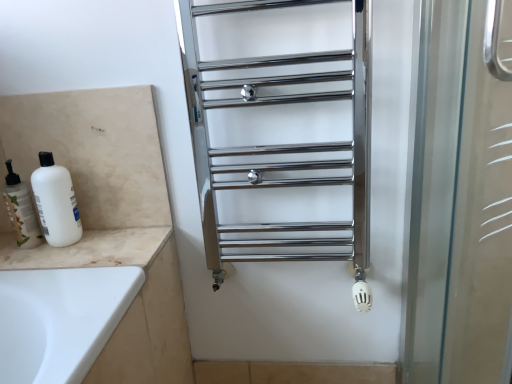
This screenshot has width=512, height=384. I want to click on white matte bottle at left, so click(x=21, y=210).

What is the approximate width of beige marble counter top at lower left?

8.49 inches.

Find the location of `polished chrome towel rack at center`. polished chrome towel rack at center is located at coordinates (281, 128).

In the scene shown: Which of these two, white matte bottle at left or beige marble counter top at lower left, stands taller?

Standing taller between the two is white matte bottle at left.

Relative to beige marble counter top at lower left, is white matte bottle at left in front or behind?

white matte bottle at left is behind beige marble counter top at lower left.

Is polished chrome towel rack at center oriented towards beige marble counter top at lower left?

No.

Can you confirm if polished chrome towel rack at center is positioned to the right of beige marble counter top at lower left?

Indeed, polished chrome towel rack at center is positioned on the right side of beige marble counter top at lower left.

Based on the photo, how many degrees apart are the facing directions of polished chrome towel rack at center and beige marble counter top at lower left?

1.02 degrees separate the facing orientations of polished chrome towel rack at center and beige marble counter top at lower left.

In the scene shown: From the image's perspective, does polished chrome towel rack at center appear higher than beige marble counter top at lower left?

Correct, polished chrome towel rack at center appears higher than beige marble counter top at lower left in the image.

From a real-world perspective, between white matte bottle at left and polished chrome towel rack at center, who is vertically lower?

white matte bottle at left.

Does white matte bottle at left turn towards polished chrome towel rack at center?

No, white matte bottle at left is not turned towards polished chrome towel rack at center.

Which of these two, white matte bottle at left or polished chrome towel rack at center, stands taller?

With more height is polished chrome towel rack at center.

Consider the image. From a real-world perspective, is beige marble counter top at lower left positioned above or below white matte bottle at left?

beige marble counter top at lower left is below white matte bottle at left.

How much distance is there between beige marble counter top at lower left and white matte bottle at left?

The distance of beige marble counter top at lower left from white matte bottle at left is 5.84 inches.

Based on their sizes in the image, would you say beige marble counter top at lower left is bigger or smaller than white matte bottle at left?

beige marble counter top at lower left is bigger than white matte bottle at left.

Would you say beige marble counter top at lower left is a long distance from white matte bottle at left?

Actually, beige marble counter top at lower left and white matte bottle at left are a little close together.

Considering the relative sizes of white matte bottle at left and beige marble counter top at lower left in the image provided, is white matte bottle at left bigger than beige marble counter top at lower left?

Yes.

From the image's perspective, is white matte bottle at left positioned above or below beige marble counter top at lower left?

Clearly, from the image's perspective, white matte bottle at left is above beige marble counter top at lower left.

Between white matte bottle at left and beige marble counter top at lower left, which one has larger width?

With larger width is beige marble counter top at lower left.

Is white matte bottle at left positioned far away from beige marble counter top at lower left?

Actually, white matte bottle at left and beige marble counter top at lower left are a little close together.

Is polished chrome towel rack at center at the left side of white matte bottle at left?

No.

This screenshot has height=384, width=512. Identify the location of cage above the white matte bottle at left (from the image's perspective). (281, 128).

Considering the points (339, 218) and (25, 207), which point is behind, point (339, 218) or point (25, 207)?

Positioned behind is point (339, 218).

Does polished chrome towel rack at center have a greater width compared to white matte bottle at left?

Indeed, polished chrome towel rack at center has a greater width compared to white matte bottle at left.

Does beige marble counter top at lower left turn towards polished chrome towel rack at center?

No, beige marble counter top at lower left is not turned towards polished chrome towel rack at center.

The height and width of the screenshot is (384, 512). In order to click on counter top on the left of the polished chrome towel rack at center in this screenshot , I will do `click(88, 250)`.

What's the angular difference between beige marble counter top at lower left and polished chrome towel rack at center's facing directions?

The angular difference between beige marble counter top at lower left and polished chrome towel rack at center is 1.02 degrees.

Which point is more forward, (x=45, y=248) or (x=213, y=148)?

The point (x=45, y=248) is closer.

The image size is (512, 384). I want to click on counter top below the white matte bottle at left (from a real-world perspective), so click(x=88, y=250).

At what (x,y) coordinates should I click in order to perform the action: click on cage that is above the beige marble counter top at lower left (from a real-world perspective). Please return your answer as a coordinate pair (x, y). The image size is (512, 384). Looking at the image, I should click on (281, 128).

Consider the image. Which object lies further to the anchor point white matte bottle at left, white matte bottle at left or polished chrome towel rack at center?

polished chrome towel rack at center lies further to white matte bottle at left than the other object.

Which object lies nearer to the anchor point white matte bottle at left, polished chrome towel rack at center or beige marble counter top at lower left?

beige marble counter top at lower left is positioned closer to the anchor white matte bottle at left.

Considering their positions, is beige marble counter top at lower left positioned further to white matte bottle at left than polished chrome towel rack at center?

Based on the image, polished chrome towel rack at center appears to be further to white matte bottle at left.

From the image, which object appears to be nearer to polished chrome towel rack at center, white matte bottle at left or white matte bottle at left?

Based on the image, white matte bottle at left appears to be nearer to polished chrome towel rack at center.

Considering their positions, is polished chrome towel rack at center positioned further to beige marble counter top at lower left than white matte bottle at left?

polished chrome towel rack at center lies further to beige marble counter top at lower left than the other object.

When comparing their distances from polished chrome towel rack at center, does beige marble counter top at lower left or white matte bottle at left seem further?

white matte bottle at left is further to polished chrome towel rack at center.

Based on their spatial positions, is beige marble counter top at lower left or white matte bottle at left closer to white matte bottle at left?

white matte bottle at left is closer to white matte bottle at left.

Based on their spatial positions, is beige marble counter top at lower left or polished chrome towel rack at center further from white matte bottle at left?

polished chrome towel rack at center is further to white matte bottle at left.

This screenshot has width=512, height=384. In order to click on cleaning product between white matte bottle at left and polished chrome towel rack at center from left to right in this screenshot , I will do `click(56, 202)`.

At what (x,y) coordinates should I click in order to perform the action: click on counter top situated between white matte bottle at left and polished chrome towel rack at center from left to right. Please return your answer as a coordinate pair (x, y). This screenshot has height=384, width=512. Looking at the image, I should click on (88, 250).

Locate an element on the screen. counter top between white matte bottle at left and polished chrome towel rack at center from left to right is located at coordinates (88, 250).

This screenshot has width=512, height=384. What are the coordinates of `toiletry between white matte bottle at left and beige marble counter top at lower left in the vertical direction` in the screenshot? It's located at [21, 210].